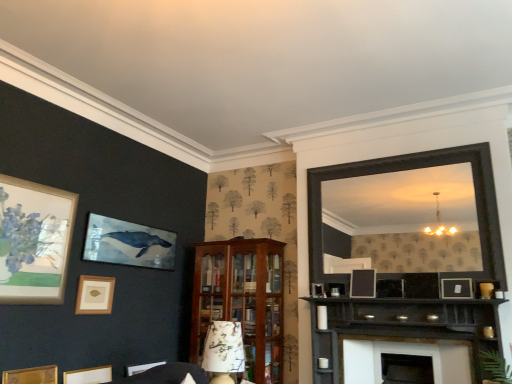
Find the location of a particular element. free spot below matte black picture frame at upper right, acting as the first picture frame starting from the right (from a real-world perspective) is located at coordinates (457, 303).